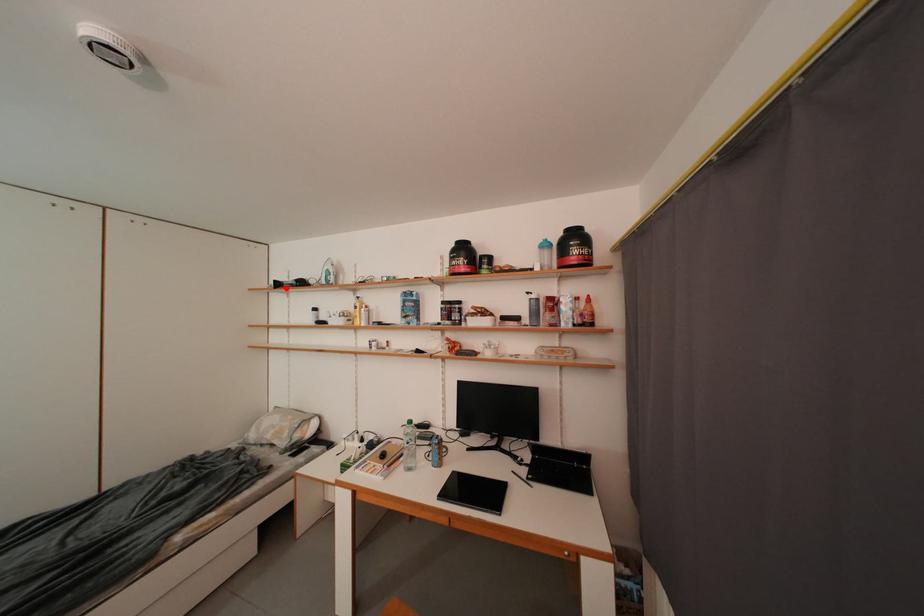
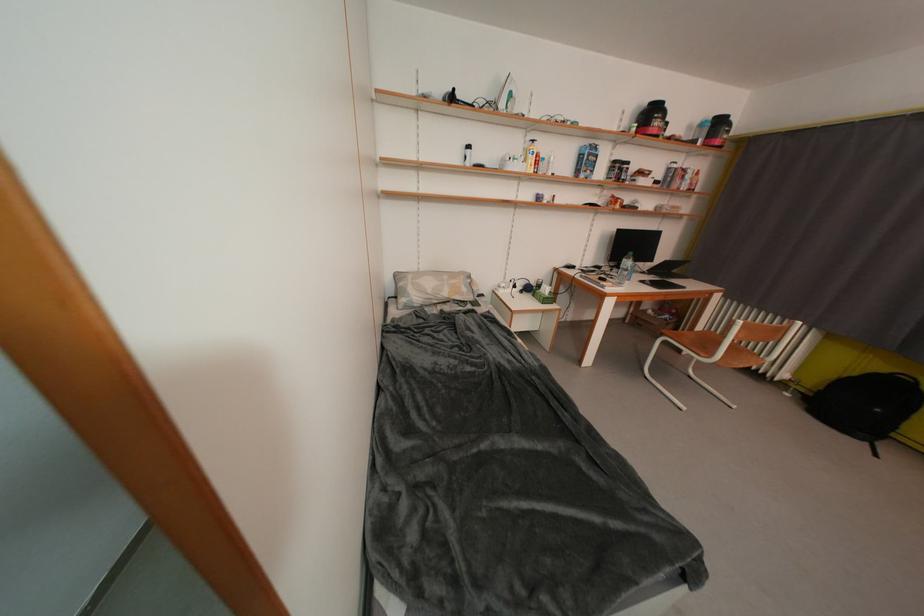
The point at the highlighted location is marked in the first image. Where is the corresponding point in the second image?

(459, 100)